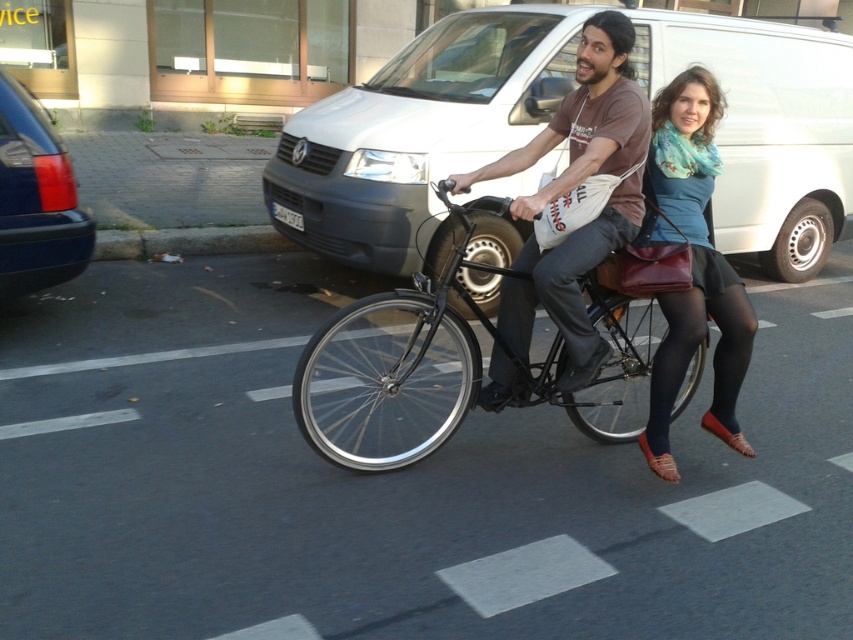
Can you confirm if white matte van at center is shorter than shiny black bicycle at center?

No, white matte van at center is not shorter than shiny black bicycle at center.

How distant is white matte van at center from shiny black bicycle at center?

The distance of white matte van at center from shiny black bicycle at center is 5.15 feet.

Does point (358, 202) come closer to viewer compared to point (633, 413)?

No, it is behind (633, 413).

Where is `white matte van at center`? white matte van at center is located at coordinates (418, 132).

Who is positioned more to the left, shiny black bicycle at center or matte brown shirt at center?

shiny black bicycle at center is more to the left.

Is shiny black bicycle at center bigger than matte brown shirt at center?

Yes, shiny black bicycle at center is bigger than matte brown shirt at center.

Which is in front, point (329, 432) or point (544, 144)?

Point (544, 144)

Locate an element on the screen. This screenshot has height=640, width=853. shiny black bicycle at center is located at coordinates (389, 374).

Can you confirm if white matte van at center is wider than matte brown shirt at center?

Indeed, white matte van at center has a greater width compared to matte brown shirt at center.

Who is more distant from viewer, (723, 120) or (608, 145)?

Point (723, 120)

The image size is (853, 640). What are the coordinates of `white matte van at center` in the screenshot? It's located at (418, 132).